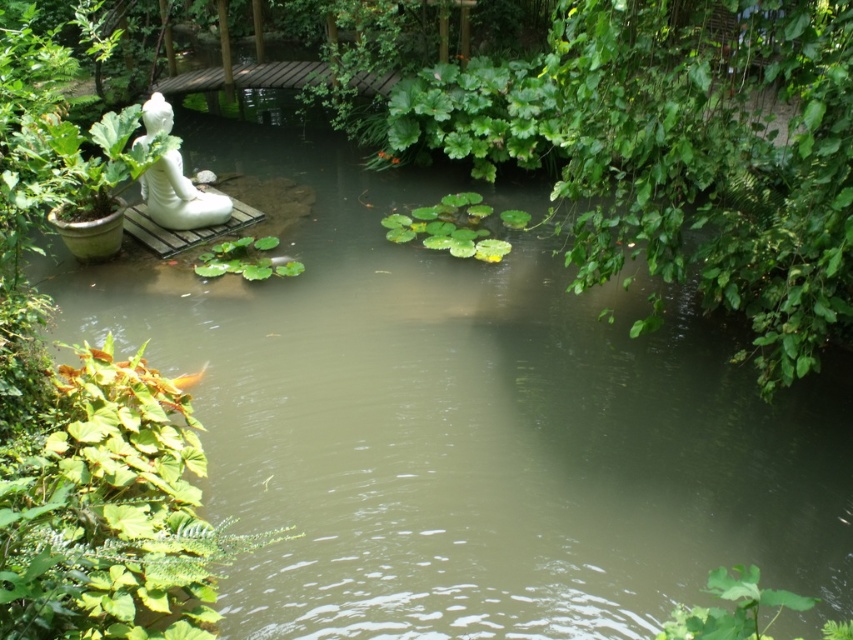
Who is taller, green leafy lily pads at center or white glossy statue at upper left?

Standing taller between the two is white glossy statue at upper left.

Between green leafy lily pads at center and white glossy statue at upper left, which one appears on the right side from the viewer's perspective?

green leafy lily pads at center

Is point (477, 218) behind point (166, 214)?

Yes.

This screenshot has width=853, height=640. What are the coordinates of `green leafy lily pads at center` in the screenshot? It's located at point(450,227).

Is green leafy plant at lower left thinner than green leafy plant at center?

In fact, green leafy plant at lower left might be wider than green leafy plant at center.

Is green leafy plant at lower left to the right of green leafy plant at center from the viewer's perspective?

Indeed, green leafy plant at lower left is positioned on the right side of green leafy plant at center.

The height and width of the screenshot is (640, 853). What do you see at coordinates (109, 512) in the screenshot? I see `green leafy plant at lower left` at bounding box center [109, 512].

At what (x,y) coordinates should I click in order to perform the action: click on green leafy plant at lower left. Please return your answer as a coordinate pair (x, y). This screenshot has width=853, height=640. Looking at the image, I should click on (109, 512).

In the scene shown: Who is higher up, green leafy plant at lower left or white glossy statue at upper left?

white glossy statue at upper left is above.

Locate an element on the screen. The width and height of the screenshot is (853, 640). green leafy plant at lower left is located at coordinates (109, 512).

Is point (109, 540) farther from viewer compared to point (144, 138)?

No.

Locate an element on the screen. green leafy plant at lower left is located at coordinates (109, 512).